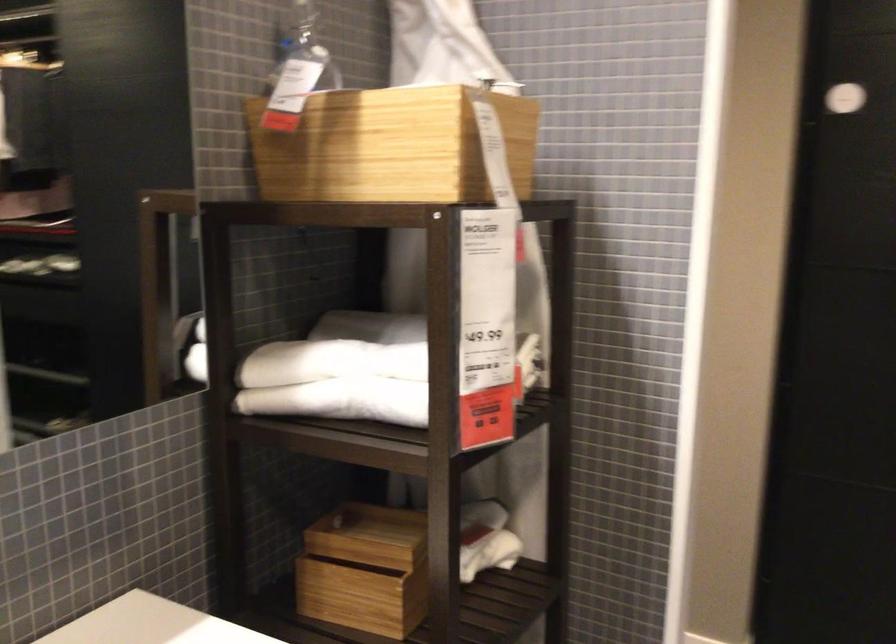
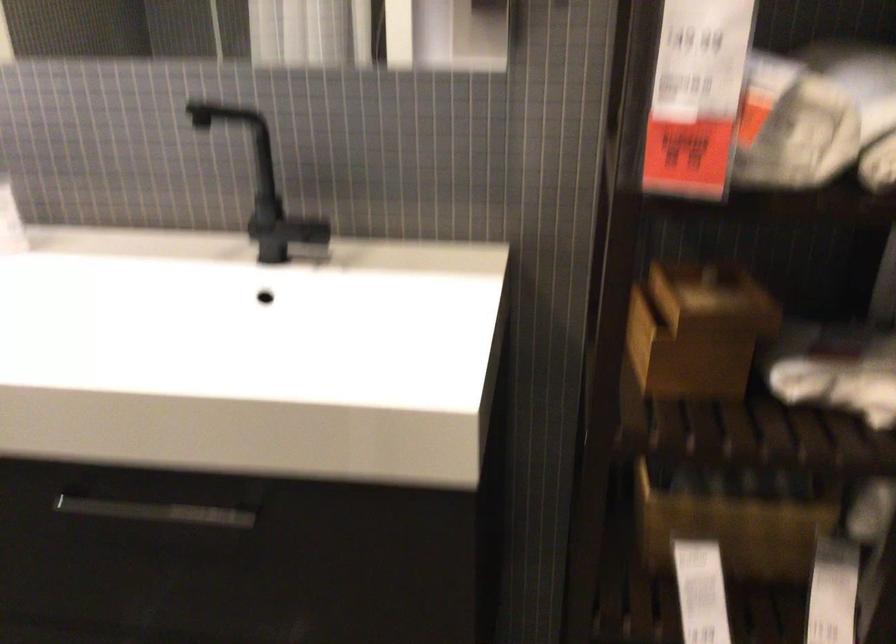
In the second image, find the point that corresponds to (416,564) in the first image.

(696, 330)